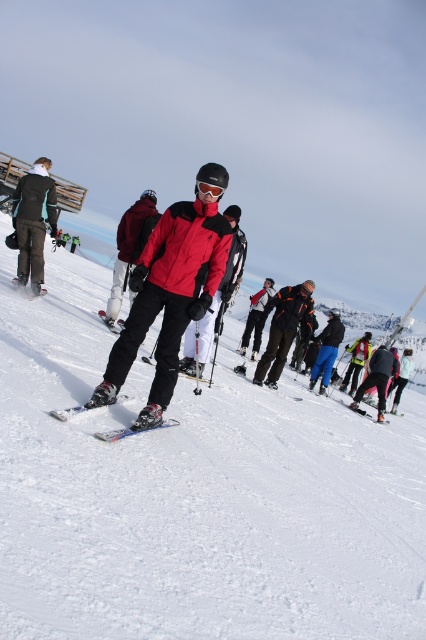
Does white powdery snow at center appear on the right side of metallic blue skis at center?

Incorrect, white powdery snow at center is not on the right side of metallic blue skis at center.

Is point (265, 497) less distant than point (66, 417)?

No.

Who is more forward, [100,534] or [120,433]?

Positioned in front is point [100,534].

I want to click on white powdery snow at center, so click(193, 493).

Is point (49, 481) positioned after point (218, 198)?

No, it is not.

Between point (414, 588) and point (215, 189), which one is positioned behind?

The point (215, 189) is behind.

This screenshot has height=640, width=426. Identify the location of white powdery snow at center. (193, 493).

Does white powdery snow at center appear on the right side of matte red jacket at center?

In fact, white powdery snow at center is to the left of matte red jacket at center.

Does point (273, 460) lie behind point (167, 259)?

That is True.

This screenshot has height=640, width=426. I want to click on white powdery snow at center, so click(x=193, y=493).